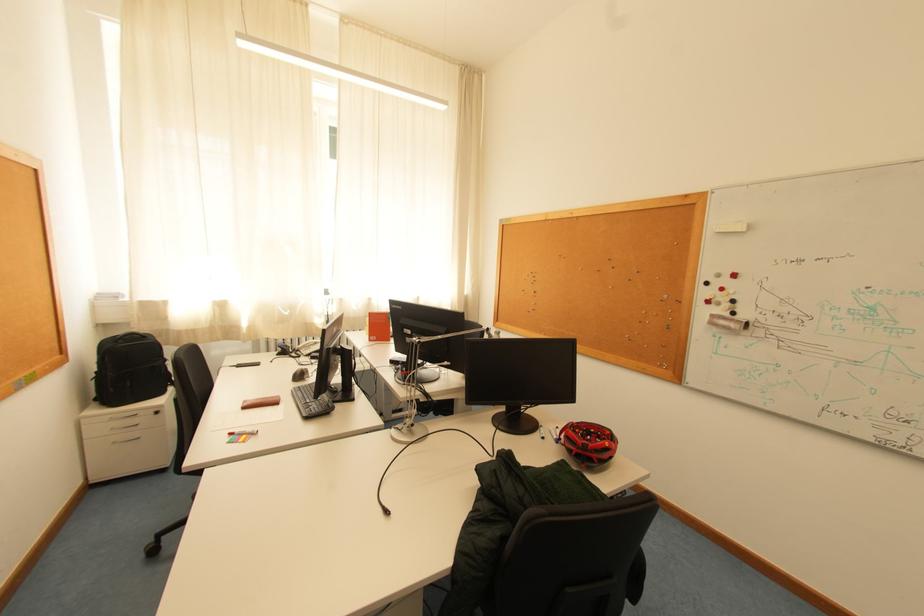
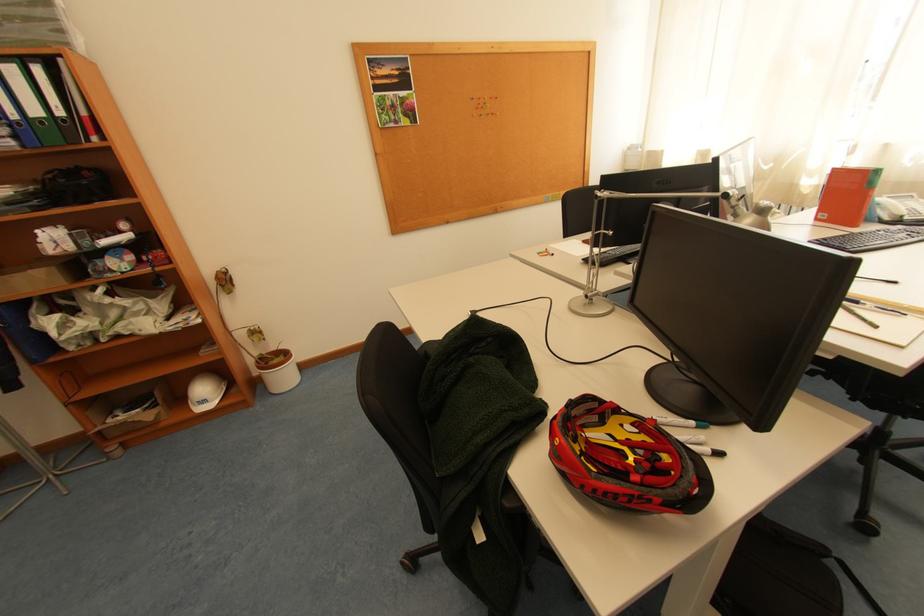
Find the pixel in the second image that matches point 379,342 in the first image.

(824, 220)